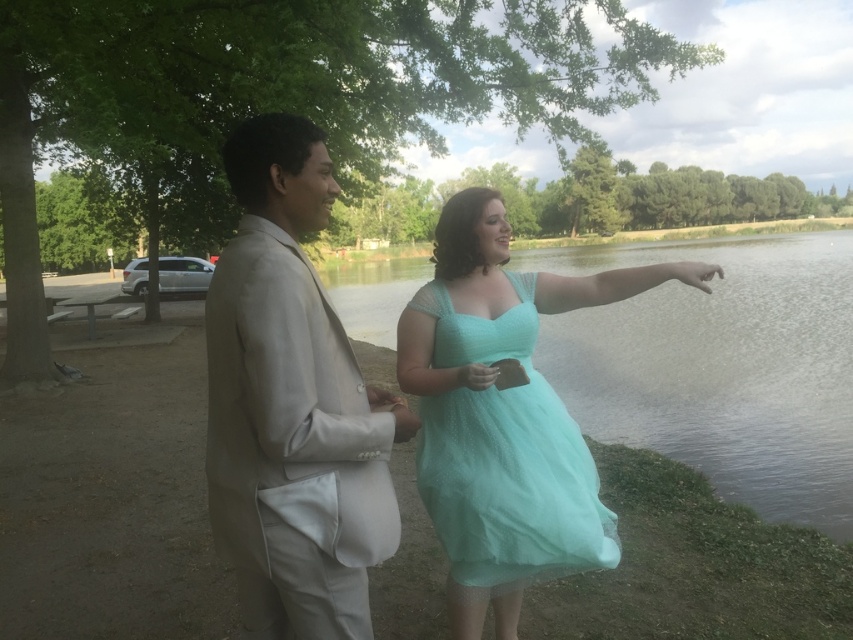
You are a photographer positioned at the center of the scene. You need to capture a photo that includes both the mint green fabric dress at right and the light beige suit on the left. Based on their positions, which direction should you move to ensure both subjects are in frame?

Since the mint green fabric dress at right is located at point 0.573 on the x and 0.845 on the y coordinates, you should move towards the center to include both the mint green fabric dress at right and the light beige suit on the left in the frame.

You are a photographer planning to capture a group photo of the mint green fabric dress at right and the satin beige suit at left. Given their sizes, which one should you position closer to the camera to ensure both appear proportionally balanced in the frame?

The mint green fabric dress at right is larger in size than the satin beige suit at left. To balance their sizes in the photo, position the smaller satin beige suit at left closer to the camera so that both appear proportionally balanced.